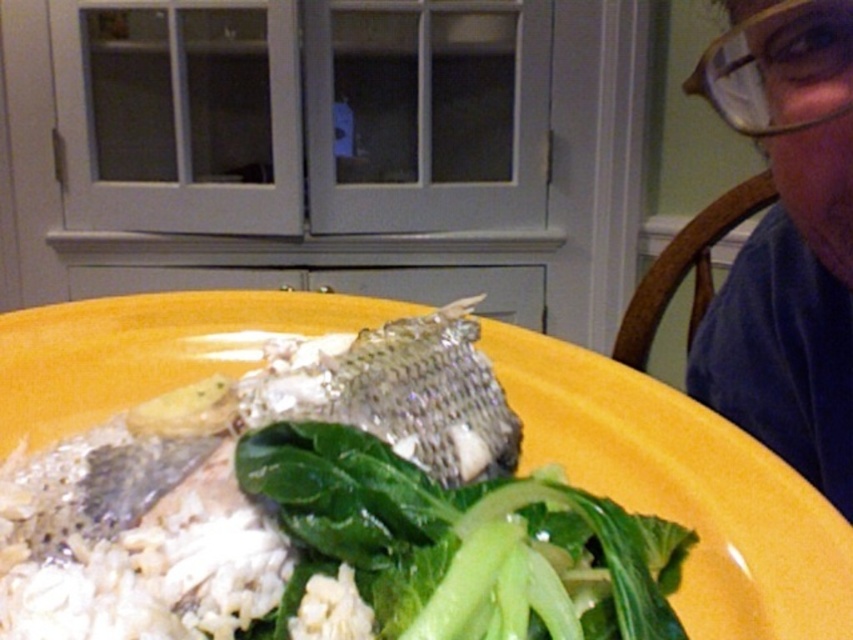
Question: Can you confirm if shiny silver fish at center is positioned to the left of green leafy at center?

Choices:
 (A) no
 (B) yes

Answer: (B)

Question: Which object is closer to the camera taking this photo?

Choices:
 (A) green leafy at center
 (B) shiny silver fish at center

Answer: (A)

Question: Is shiny silver fish at center bigger than matte blue shirt at upper right?

Choices:
 (A) yes
 (B) no

Answer: (A)

Question: Among these objects, which one is nearest to the camera?

Choices:
 (A) green leafy at center
 (B) shiny silver fish at center

Answer: (A)

Question: Which is farther from the shiny silver fish at center?

Choices:
 (A) matte blue shirt at upper right
 (B) green leafy at center

Answer: (A)

Question: Can you confirm if shiny silver fish at center is wider than green leafy at center?

Choices:
 (A) no
 (B) yes

Answer: (B)